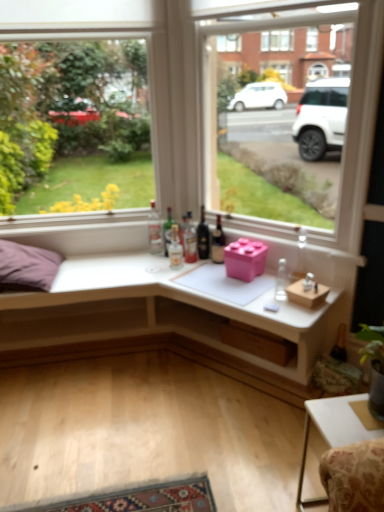
Identify the location of unoccupied area in front of translucent glass bottle at center, which ranks as the 2th bottle in left-to-right order. This screenshot has height=512, width=384. (163, 266).